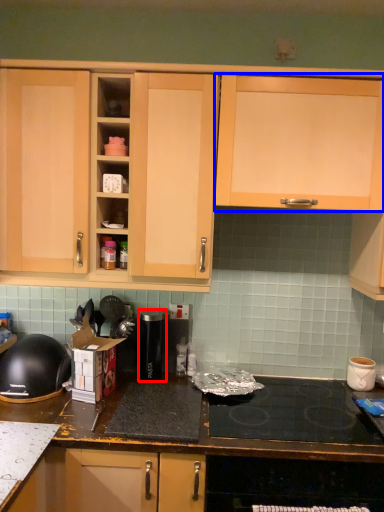
Question: Among these objects, which one is nearest to the camera, appliance (highlighted by a red box) or cabinetry (highlighted by a blue box)?

Choices:
 (A) appliance
 (B) cabinetry

Answer: (B)